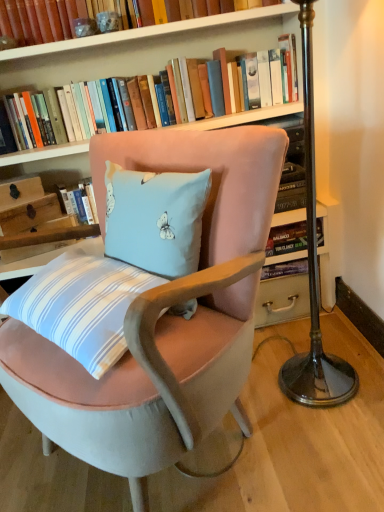
Question: Is hardcover books at upper center, which appears as the first book when ordered from the bottom, next to velvet pink chair at center?

Choices:
 (A) yes
 (B) no

Answer: (B)

Question: Is hardcover books at upper center, which appears as the first book when ordered from the bottom, outside of velvet pink chair at center?

Choices:
 (A) yes
 (B) no

Answer: (A)

Question: Is hardcover books at upper center, which appears as the first book when ordered from the bottom, positioned with its back to velvet pink chair at center?

Choices:
 (A) no
 (B) yes

Answer: (A)

Question: Is hardcover books at upper center, the second book when ordered from top to bottom, facing towards velvet pink chair at center?

Choices:
 (A) yes
 (B) no

Answer: (B)

Question: Is hardcover books at upper center, which appears as the first book when ordered from the bottom, far from velvet pink chair at center?

Choices:
 (A) yes
 (B) no

Answer: (B)

Question: Does hardcover books at upper center, the second book when ordered from top to bottom, come in front of velvet pink chair at center?

Choices:
 (A) yes
 (B) no

Answer: (B)

Question: Considering the relative positions of velvet pink chair at center and wooden drawer at left, the first drawer ordered from the bottom, in the image provided, is velvet pink chair at center to the left of wooden drawer at left, the first drawer ordered from the bottom, from the viewer's perspective?

Choices:
 (A) no
 (B) yes

Answer: (A)

Question: From the image's perspective, would you say velvet pink chair at center is shown under wooden drawer at left, the first drawer ordered from the bottom?

Choices:
 (A) no
 (B) yes

Answer: (B)

Question: Can wooden drawer at left, the first drawer ordered from the bottom, be found inside velvet pink chair at center?

Choices:
 (A) yes
 (B) no

Answer: (B)

Question: From a real-world perspective, does velvet pink chair at center sit lower than wooden drawer at left, which ranks as the 2th drawer in top-to-bottom order?

Choices:
 (A) no
 (B) yes

Answer: (B)

Question: Does velvet pink chair at center come behind wooden drawer at left, which ranks as the 2th drawer in top-to-bottom order?

Choices:
 (A) yes
 (B) no

Answer: (B)

Question: Does velvet pink chair at center have a greater height compared to wooden drawer at left, which ranks as the 2th drawer in top-to-bottom order?

Choices:
 (A) no
 (B) yes

Answer: (B)

Question: Can you confirm if hardcover book at upper center, the second book ordered from the bottom, is positioned to the right of hardcover books at upper center, the second book when ordered from top to bottom?

Choices:
 (A) yes
 (B) no

Answer: (A)